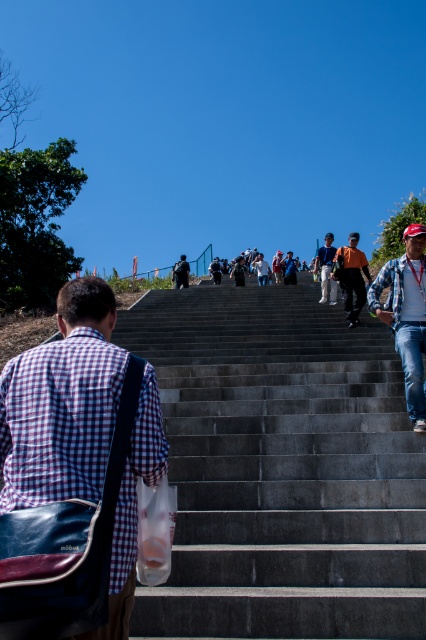
Question: Estimate the real-world distances between objects in this image. Which object is closer to the denim jeans at right?

Choices:
 (A) smooth concrete stairs at center
 (B) dark gray jeans at center
 (C) orange fabric shirt at center
 (D) dark gray backpack at center

Answer: (A)

Question: Can you confirm if orange fabric shirt at center is thinner than dark gray jeans at center?

Choices:
 (A) yes
 (B) no

Answer: (A)

Question: Which point is closer to the camera taking this photo?

Choices:
 (A) (333, 300)
 (B) (353, 314)
 (C) (221, 422)
 (D) (180, 262)

Answer: (C)

Question: Does plaid fabric shirt at center appear on the left side of dark gray jeans at center?

Choices:
 (A) no
 (B) yes

Answer: (B)

Question: Which point appears farthest from the camera in this image?

Choices:
 (A) 322,259
 (B) 354,269
 (C) 414,385
 (D) 54,422

Answer: (A)

Question: Does smooth concrete stairs at center appear on the left side of dark gray jeans at center?

Choices:
 (A) no
 (B) yes

Answer: (B)